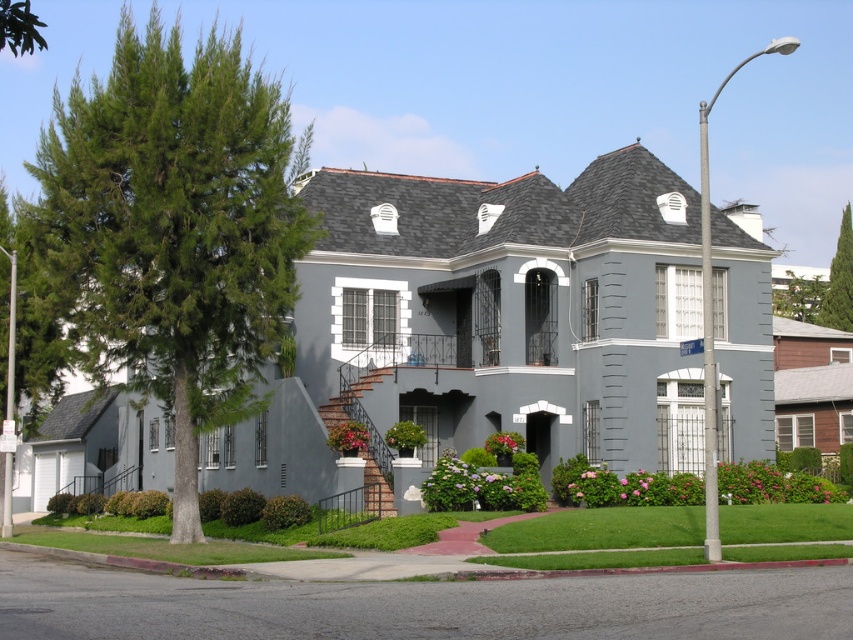
Can you confirm if green leafy tree at upper right is shorter than green leafy tree at upper left?

Indeed, green leafy tree at upper right has a lesser height compared to green leafy tree at upper left.

Does green leafy tree at upper right have a greater width compared to green leafy tree at upper left?

No, green leafy tree at upper right is not wider than green leafy tree at upper left.

Does point (845, 292) come behind point (35, 36)?

Yes, it is.

The width and height of the screenshot is (853, 640). Identify the location of green leafy tree at upper right. (839, 280).

Is green needle-like leaves at left taller than green leafy tree at upper left?

Correct, green needle-like leaves at left is much taller as green leafy tree at upper left.

Who is more distant from viewer, (125, 10) or (10, 22)?

The point (125, 10) is more distant.

You are a GUI agent. You are given a task and a screenshot of the screen. Output one action in this format:
    pyautogui.click(x=<x>, y=<y>)
    Task: Click on the green needle-like leaves at left
    
    Given the screenshot: What is the action you would take?
    pyautogui.click(x=173, y=228)

Is green needle-like leaves at left taller than green leafy tree at upper right?

Yes.

Based on the photo, who is more forward, [294,275] or [850,330]?

Positioned in front is point [294,275].

In order to click on green needle-like leaves at left in this screenshot , I will do `click(173, 228)`.